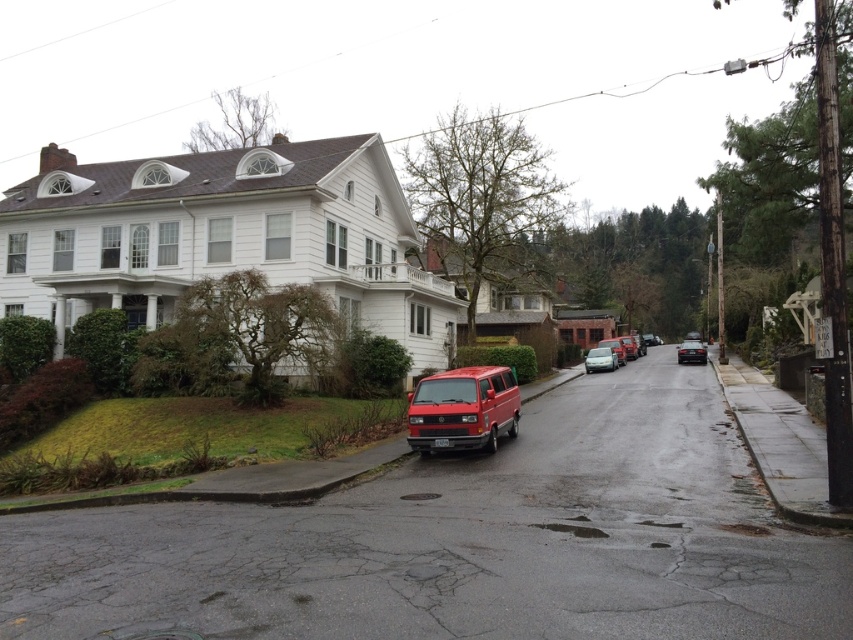
Can you confirm if matte red van at center is positioned to the right of metallic silver sedan at center?

In fact, matte red van at center is to the left of metallic silver sedan at center.

Does matte red van at center appear over metallic silver sedan at center?

Actually, matte red van at center is below metallic silver sedan at center.

Who is more distant from viewer, (415, 403) or (590, 371)?

The point (590, 371) is behind.

Where is `matte red van at center`? The width and height of the screenshot is (853, 640). matte red van at center is located at coordinates (463, 410).

Which is more to the left, matte red van at center or shiny black sedan at center?

Positioned to the left is matte red van at center.

Does matte red van at center appear on the right side of shiny black sedan at center?

No, matte red van at center is not to the right of shiny black sedan at center.

Does point (471, 419) come farther from viewer compared to point (693, 349)?

No, it is not.

In order to click on matte red van at center in this screenshot , I will do `click(463, 410)`.

Is metallic silver sedan at center wider than shiny black sedan at center?

No.

Between metallic silver sedan at center and shiny black sedan at center, which one has less height?

shiny black sedan at center

Which is behind, point (596, 371) or point (700, 358)?

The point (700, 358) is behind.

The width and height of the screenshot is (853, 640). What are the coordinates of `metallic silver sedan at center` in the screenshot? It's located at (601, 358).